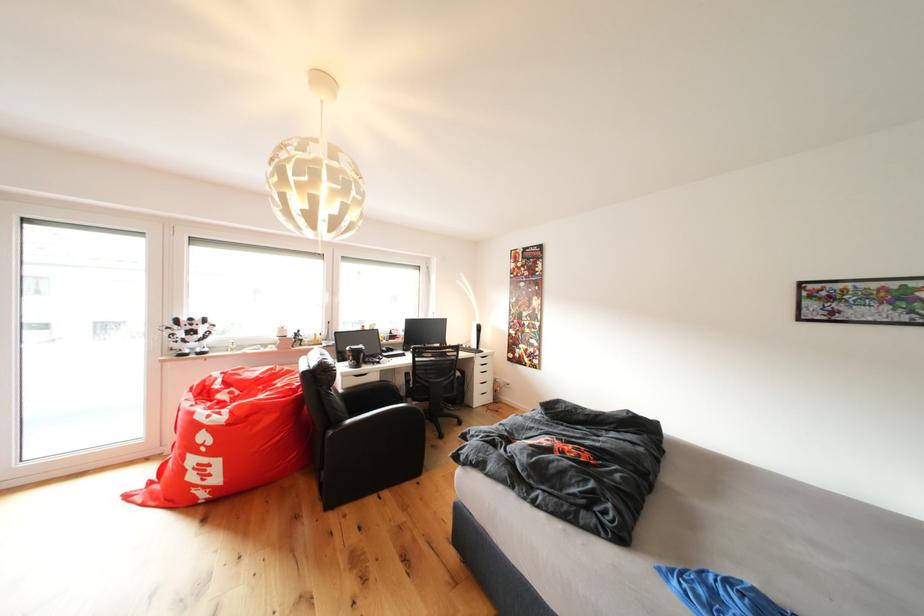
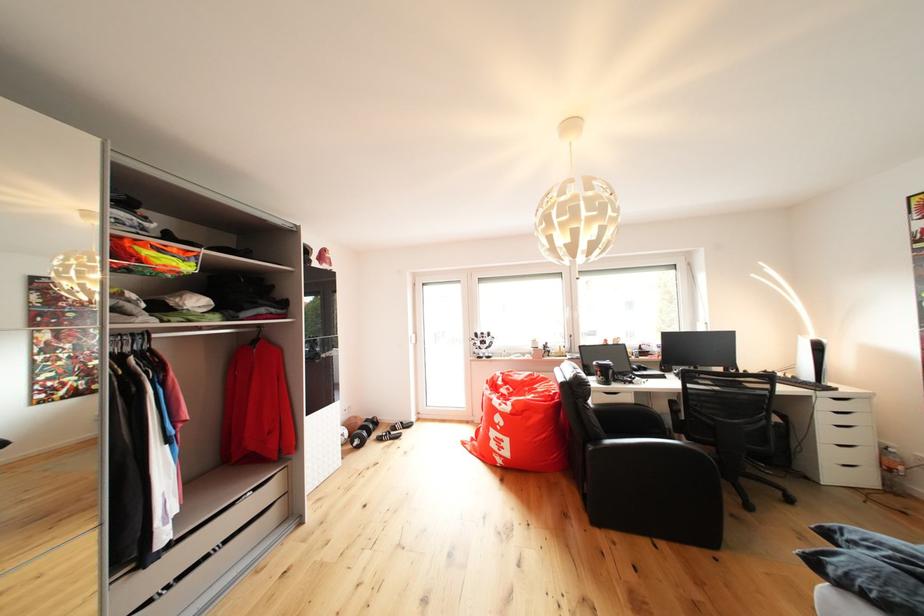
Find the pixel in the second image that matches the point at 487,328 in the first image.

(822, 342)